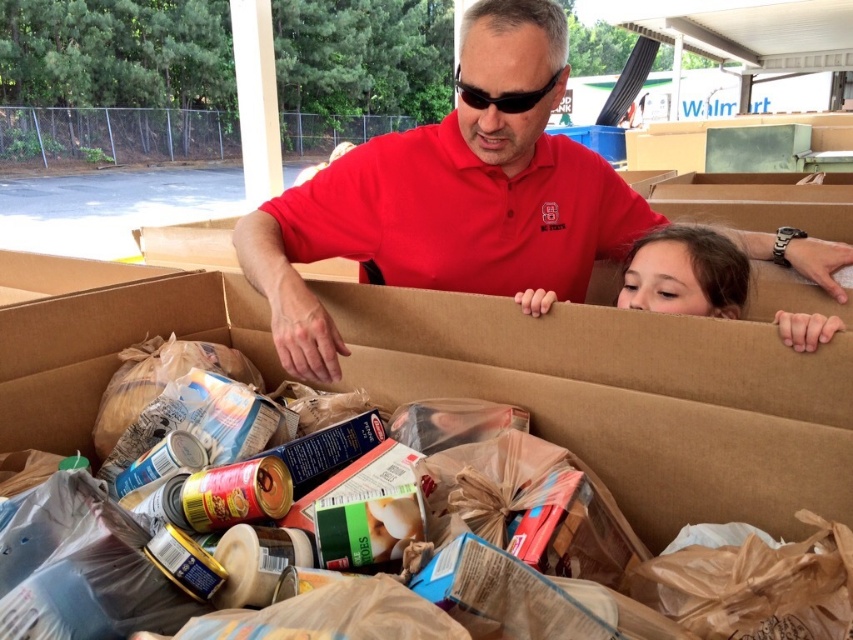
You are a delivery person trying to place a new box next to the brown cardboard box at center and the smooth brown hair at upper right. Which object should you move to make space?

The smooth brown hair at upper right is narrower than the brown cardboard box at center, so you should move the smooth brown hair at upper right to make space.

In the scene shown: You are a delivery person who needs to place a new item between the matte red shirt at center and the black plastic goggles at upper center. Based on their positions, which side should you place the item closer to?

The matte red shirt at center is to the right of the black plastic goggles at upper center, so you should place the item closer to the left side of the matte red shirt at center or the right side of the black plastic goggles at upper center to position it between them.